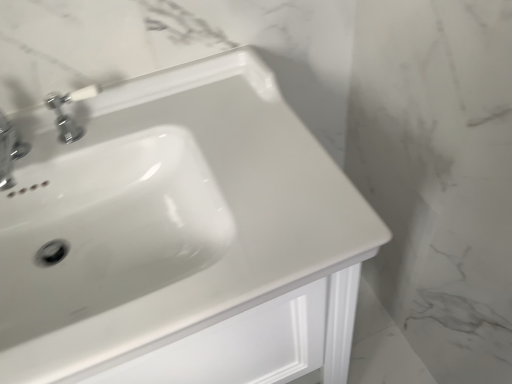
Image resolution: width=512 pixels, height=384 pixels. I want to click on vacant area that lies between chrome metallic faucet at upper left, which is the second tap in left-to-right order, and chrome metallic faucet at upper left, placed as the second tap when sorted from right to left, so click(x=69, y=152).